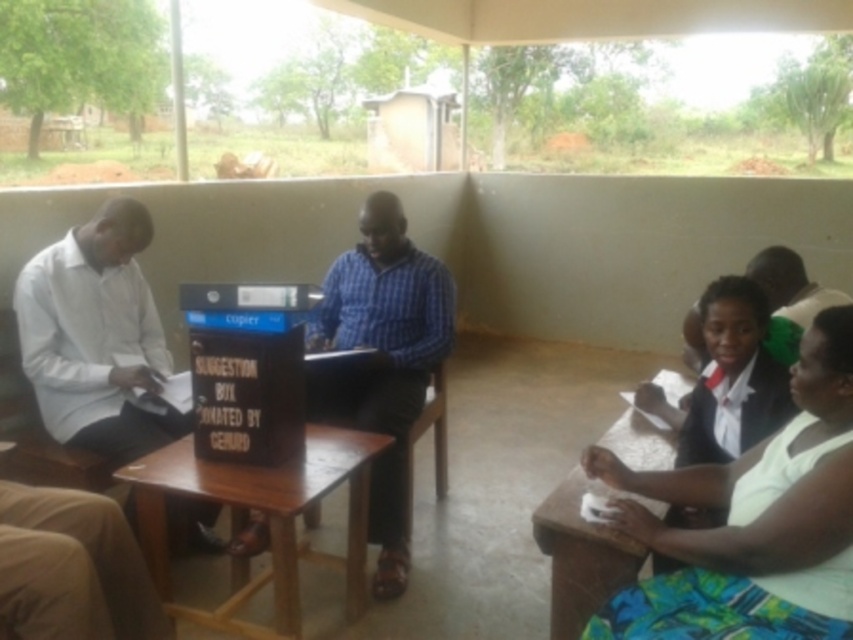
Question: Which object is closer to the camera taking this photo?

Choices:
 (A) wooden table at lower right
 (B) white matte shirt at left

Answer: (A)

Question: Is blue plaid shirt at center closer to the viewer compared to brown wooden table at center?

Choices:
 (A) no
 (B) yes

Answer: (A)

Question: Among these objects, which one is nearest to the camera?

Choices:
 (A) brown wooden table at center
 (B) white matte shirt at left
 (C) matte blue shirt at right

Answer: (A)

Question: Considering the relative positions of white matte shirt at left and wooden table at lower right in the image provided, where is white matte shirt at left located with respect to wooden table at lower right?

Choices:
 (A) left
 (B) right

Answer: (A)

Question: Can you confirm if white fabric dress at lower right is thinner than brown wooden table at center?

Choices:
 (A) yes
 (B) no

Answer: (A)

Question: Which object is farther from the camera taking this photo?

Choices:
 (A) brown wooden table at center
 (B) white matte shirt at left
 (C) matte blue shirt at right
 (D) wooden table at lower right

Answer: (B)